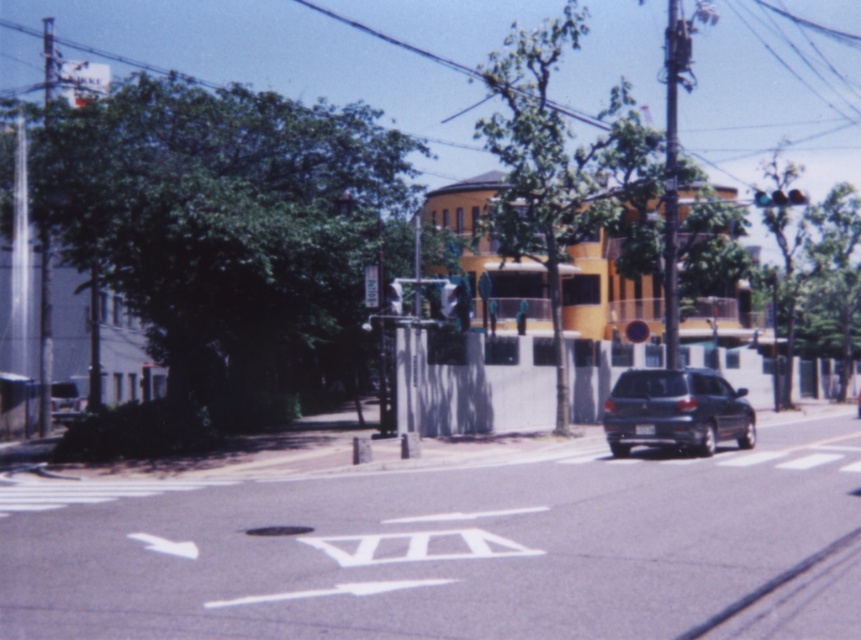
Question: Which object is positioned farthest from the matte black suv at center?

Choices:
 (A) metallic silver traffic light at center
 (B) blue glass traffic light at upper right
 (C) shiny silver sedan at center

Answer: (C)

Question: Does metallic reflective street sign at center have a lesser width compared to shiny silver sedan at center?

Choices:
 (A) yes
 (B) no

Answer: (A)

Question: Which point is farther to the camera?

Choices:
 (A) (858, 412)
 (B) (697, 442)
 (C) (370, 280)
 (D) (801, 195)

Answer: (A)

Question: Does matte black suv at center appear on the right side of metallic silver traffic light at center?

Choices:
 (A) yes
 (B) no

Answer: (A)

Question: Does metallic silver traffic light at center have a lesser width compared to shiny silver sedan at center?

Choices:
 (A) no
 (B) yes

Answer: (B)

Question: Which of these objects is positioned closest to the matte black suv at center?

Choices:
 (A) shiny silver sedan at center
 (B) metallic silver traffic light at center
 (C) metallic reflective street sign at center

Answer: (C)